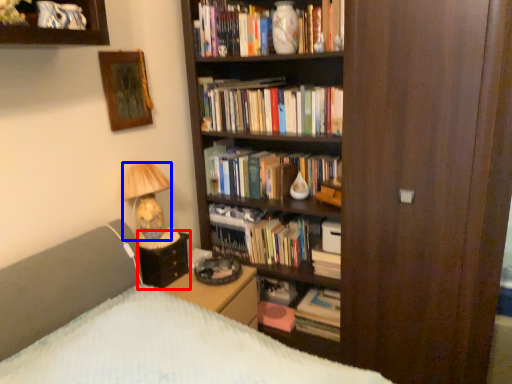
Question: Which point is further to the camera, side table (highlighted by a red box) or lamp (highlighted by a blue box)?

Choices:
 (A) side table
 (B) lamp

Answer: (A)